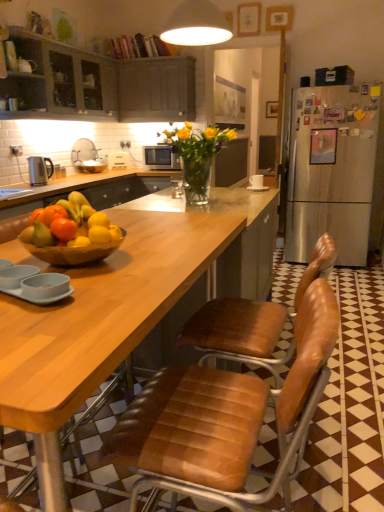
Question: Is orange matte at center turned away from matte gray cabinets at upper left, placed as the first cabinetry when sorted from left to right?

Choices:
 (A) yes
 (B) no

Answer: (B)

Question: Does orange matte at center appear on the left side of matte gray cabinets at upper left, placed as the first cabinetry when sorted from left to right?

Choices:
 (A) no
 (B) yes

Answer: (A)

Question: Does orange matte at center turn towards matte gray cabinets at upper left, placed as the first cabinetry when sorted from left to right?

Choices:
 (A) no
 (B) yes

Answer: (A)

Question: Considering the relative sizes of orange matte at center and matte gray cabinets at upper left, placed as the first cabinetry when sorted from left to right, in the image provided, is orange matte at center taller than matte gray cabinets at upper left, placed as the first cabinetry when sorted from left to right,?

Choices:
 (A) yes
 (B) no

Answer: (B)

Question: Can you confirm if orange matte at center is shorter than matte gray cabinets at upper left, placed as the first cabinetry when sorted from left to right?

Choices:
 (A) no
 (B) yes

Answer: (B)

Question: From a real-world perspective, relative to matte white sink at upper left, is matte gray cabinets at upper left, placed as the first cabinetry when sorted from left to right, vertically above or below?

Choices:
 (A) above
 (B) below

Answer: (A)

Question: In the image, is matte gray cabinets at upper left, the 2th cabinetry when ordered from right to left, positioned in front of or behind matte white sink at upper left?

Choices:
 (A) behind
 (B) front

Answer: (B)

Question: Is matte gray cabinets at upper left, placed as the first cabinetry when sorted from left to right, taller or shorter than matte white sink at upper left?

Choices:
 (A) tall
 (B) short

Answer: (A)

Question: In the image, is matte gray cabinets at upper left, the 2th cabinetry when ordered from right to left, on the left side or the right side of matte white sink at upper left?

Choices:
 (A) left
 (B) right

Answer: (A)

Question: From the image's perspective, is translucent glass vase at center above or below matte white sink at upper left?

Choices:
 (A) above
 (B) below

Answer: (B)

Question: In terms of height, does translucent glass vase at center look taller or shorter compared to matte white sink at upper left?

Choices:
 (A) tall
 (B) short

Answer: (A)

Question: Looking at the image, does translucent glass vase at center seem bigger or smaller compared to matte white sink at upper left?

Choices:
 (A) big
 (B) small

Answer: (A)

Question: In the image, is translucent glass vase at center positioned in front of or behind matte white sink at upper left?

Choices:
 (A) front
 (B) behind

Answer: (A)

Question: Looking at the image, does orange matte at center seem bigger or smaller compared to matte gray cabinets at upper left, placed as the first cabinetry when sorted from left to right?

Choices:
 (A) big
 (B) small

Answer: (B)

Question: In terms of width, does orange matte at center look wider or thinner when compared to matte gray cabinets at upper left, the 2th cabinetry when ordered from right to left?

Choices:
 (A) thin
 (B) wide

Answer: (A)